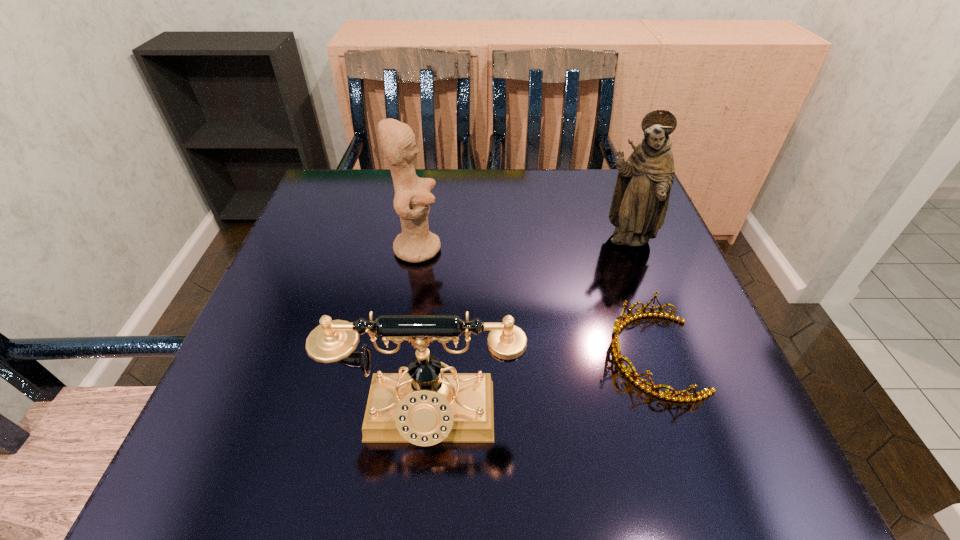
Where is `the left figurine`? Image resolution: width=960 pixels, height=540 pixels. the left figurine is located at coordinates (412, 200).

I want to click on the right figurine, so click(x=640, y=200).

Find the location of a particular element. This screenshot has height=540, width=960. telephone is located at coordinates (425, 406).

Find the location of a particular element. The image size is (960, 540). tiara is located at coordinates (632, 375).

This screenshot has height=540, width=960. In order to click on vacant space located 0.290m on the front-facing side of the left figurine in this screenshot , I will do `click(576, 248)`.

Image resolution: width=960 pixels, height=540 pixels. What are the coordinates of `blank area located 0.260m on the front-facing side of the right figurine` in the screenshot? It's located at (673, 361).

Where is `free point located on the front-facing side of the shortest object`? free point located on the front-facing side of the shortest object is located at coordinates (536, 355).

The image size is (960, 540). In order to click on free space located on the front-facing side of the shortest object in this screenshot , I will do coord(548,355).

At what (x,y) coordinates should I click in order to perform the action: click on vacant region located 0.290m on the front-facing side of the shortest object. Please return your answer as a coordinate pair (x, y). Image resolution: width=960 pixels, height=540 pixels. Looking at the image, I should click on (436, 355).

Where is `object that is positioned at the near edge`? The image size is (960, 540). object that is positioned at the near edge is located at coordinates (425, 406).